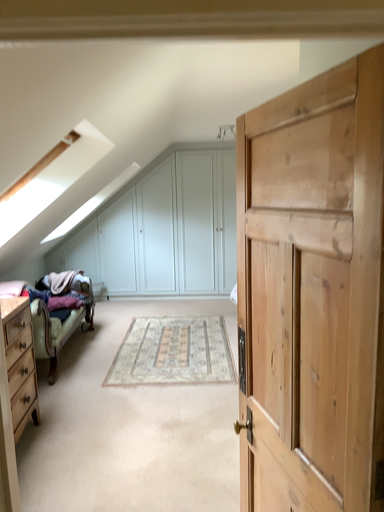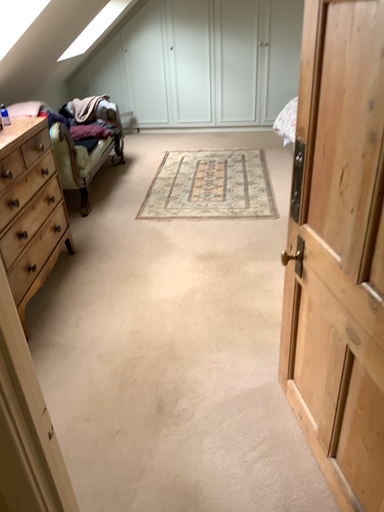
Question: Which way did the camera rotate in the video?

Choices:
 (A) rotated downward
 (B) rotated upward

Answer: (A)